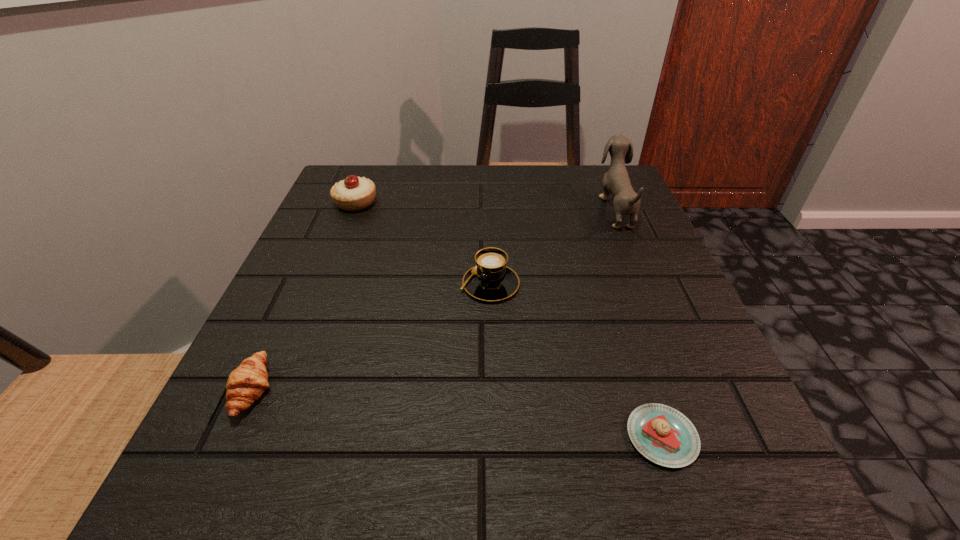
Identify the location of puppy. This screenshot has height=540, width=960. (616, 181).

What are the coordinates of `the fourth shortest object` in the screenshot? It's located at (354, 193).

Where is `the farthest pastry`? This screenshot has height=540, width=960. the farthest pastry is located at coordinates (354, 193).

The height and width of the screenshot is (540, 960). I want to click on the third object from left to right, so click(x=490, y=280).

Locate an element on the screen. The height and width of the screenshot is (540, 960). the third farthest object is located at coordinates click(x=490, y=280).

The image size is (960, 540). Identify the location of the second tallest pastry. (245, 384).

This screenshot has width=960, height=540. I want to click on the shortest pastry, so [x=662, y=434].

I want to click on the shortest object, so click(x=662, y=434).

Locate an element on the screen. free point located 0.130m at the face of the tallest object is located at coordinates (542, 208).

Find the location of `vacant space located at the face of the tallest object`. vacant space located at the face of the tallest object is located at coordinates (443, 208).